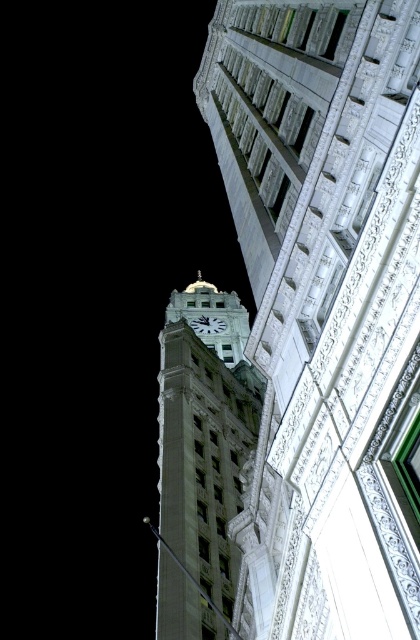
Question: Which object appears closest to the camera in this image?

Choices:
 (A) white stone clock tower at center
 (B) white glossy clock at center
 (C) green copper clock tower at left

Answer: (C)

Question: Among these points, which one is farthest from the camera?

Choices:
 (A) (173, 369)
 (B) (238, 93)
 (C) (225, 326)

Answer: (C)

Question: Where is green copper clock tower at left located in relation to white stone clock tower at center in the image?

Choices:
 (A) above
 (B) below

Answer: (A)

Question: Can you confirm if green copper clock tower at left is bigger than white stone clock tower at center?

Choices:
 (A) no
 (B) yes

Answer: (A)

Question: Is white stone clock tower at center behind white glossy clock at center?

Choices:
 (A) no
 (B) yes

Answer: (A)

Question: Which of the following is the farthest from the observer?

Choices:
 (A) white glossy clock at center
 (B) white stone clock tower at center
 (C) green copper clock tower at left

Answer: (A)